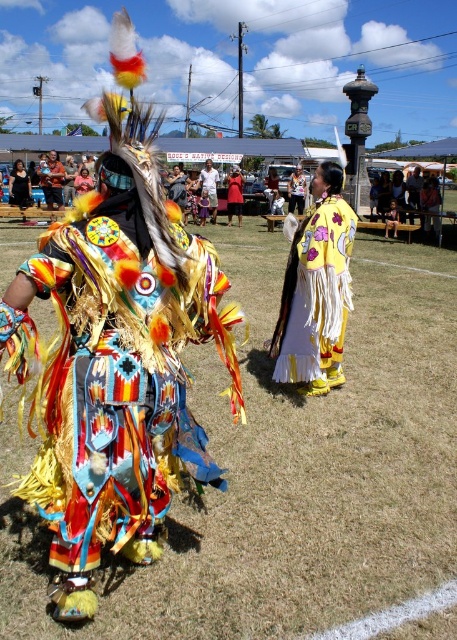
Does multicolored fabric costume at center have a larger size compared to yellow fabric dress at center?

No, multicolored fabric costume at center is not bigger than yellow fabric dress at center.

Is multicolored fabric costume at center further to camera compared to yellow fabric dress at center?

No.

Locate an element on the screen. Image resolution: width=457 pixels, height=640 pixels. multicolored fabric costume at center is located at coordinates (116, 380).

Describe the element at coordinates (20, 186) in the screenshot. The image size is (457, 640). I see `matte black dress at center` at that location.

Which is above, matte black dress at center or yellow fabric dress at center?

yellow fabric dress at center

What do you see at coordinates (20, 186) in the screenshot? The image size is (457, 640). I see `matte black dress at center` at bounding box center [20, 186].

You are a GUI agent. You are given a task and a screenshot of the screen. Output one action in this format:
    pyautogui.click(x=<x>, y=<y>)
    Task: Click on the matte black dress at center
    
    Given the screenshot: What is the action you would take?
    pyautogui.click(x=20, y=186)

Is point (126, 486) positioned behind point (24, 193)?

No.

Does multicolored fabric costume at center appear over matte black dress at center?

Incorrect, multicolored fabric costume at center is not positioned above matte black dress at center.

Is point (126, 380) closer to camera compared to point (22, 170)?

Yes, point (126, 380) is closer to viewer.

Find the location of `multicolored fabric costume at center`. multicolored fabric costume at center is located at coordinates (116, 380).